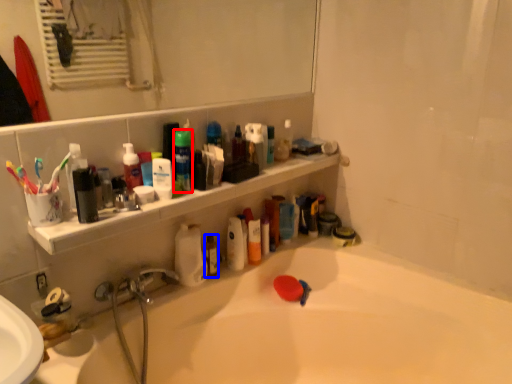
Question: Which point is further to the camera, mouthwash (highlighted by a red box) or mouthwash (highlighted by a blue box)?

Choices:
 (A) mouthwash
 (B) mouthwash

Answer: (B)